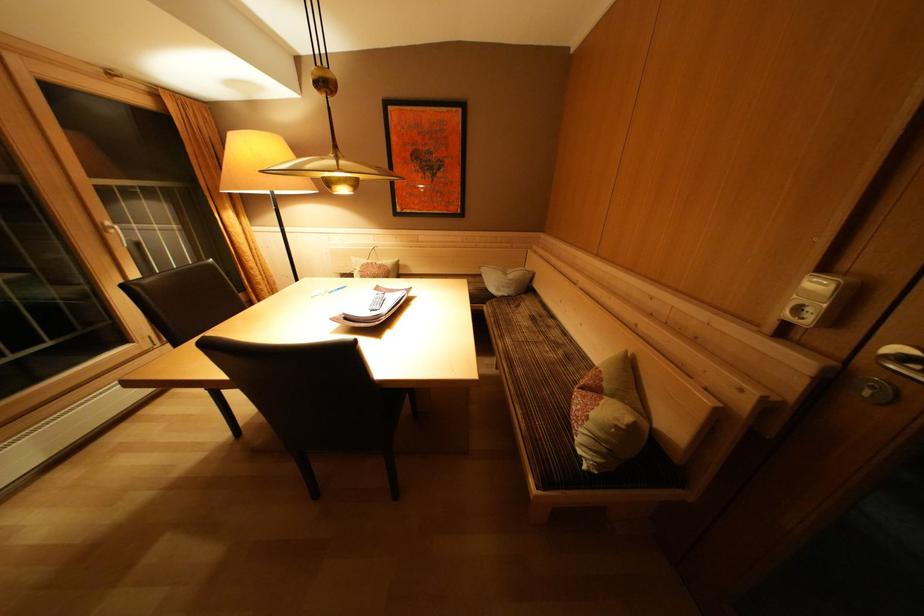
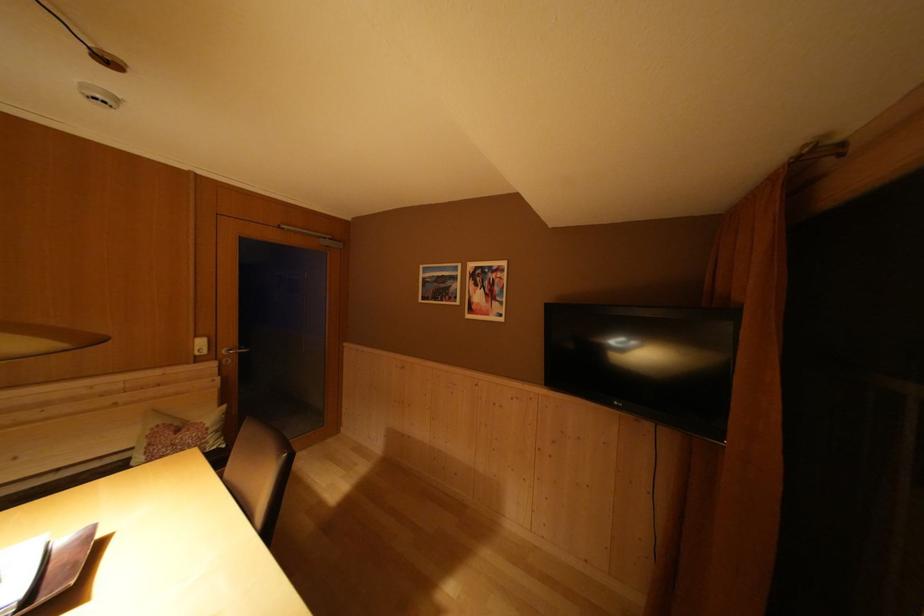
Where in the second image is the point corresponding to point (591, 471) from the first image?

(231, 451)